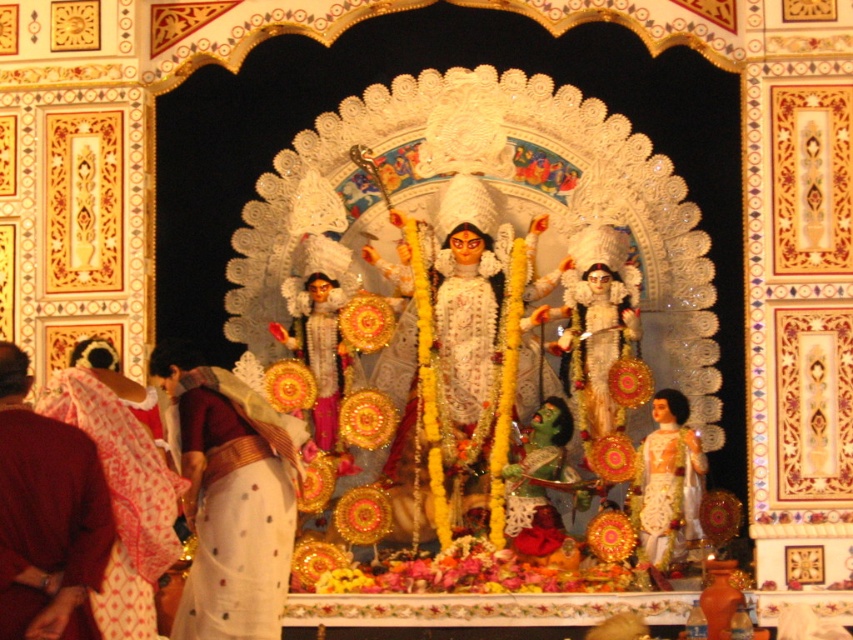
Question: Considering the real-world distances, which object is farthest from the white textured cloth at lower left?

Choices:
 (A) maroon silk robe at lower left
 (B) white glossy statue at center
 (C) white silk saree at center

Answer: (B)

Question: Can you confirm if maroon silk robe at lower left is positioned below white glossy statue at center?

Choices:
 (A) yes
 (B) no

Answer: (B)

Question: Is white silk saree at center wider than white textured cloth at lower left?

Choices:
 (A) yes
 (B) no

Answer: (B)

Question: Among these objects, which one is nearest to the camera?

Choices:
 (A) maroon silk robe at lower left
 (B) white textured cloth at lower left
 (C) white glossy statue at center

Answer: (A)

Question: Estimate the real-world distances between objects in this image. Which object is farther from the maroon silk robe at lower left?

Choices:
 (A) white glossy statue at center
 (B) white silk saree at center
 (C) white textured cloth at lower left

Answer: (A)

Question: Can you confirm if maroon silk robe at lower left is positioned above white textured cloth at lower left?

Choices:
 (A) yes
 (B) no

Answer: (B)